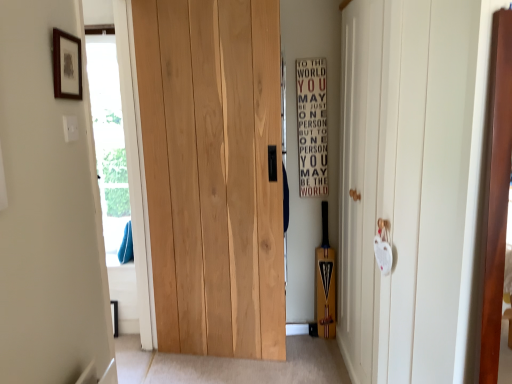
Image resolution: width=512 pixels, height=384 pixels. I want to click on vacant area to the right of natural wood door at center, the second door from the right, so 290,365.